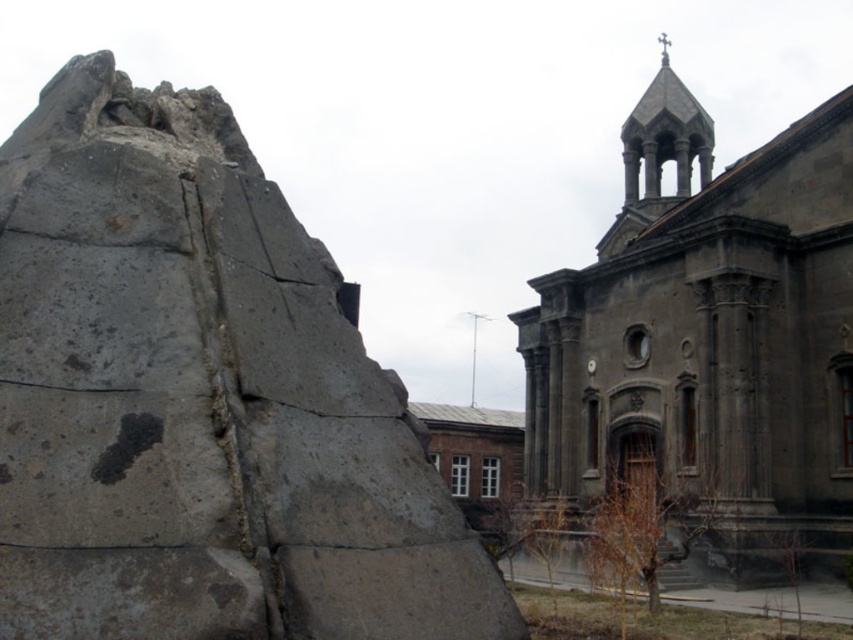
Where is `gray rough stone at left`? gray rough stone at left is located at coordinates (199, 401).

Is gray rough stone at left smaller than dark gray stone church at center?

Correct, gray rough stone at left occupies less space than dark gray stone church at center.

This screenshot has width=853, height=640. What are the coordinates of `gray rough stone at left` in the screenshot? It's located at (199, 401).